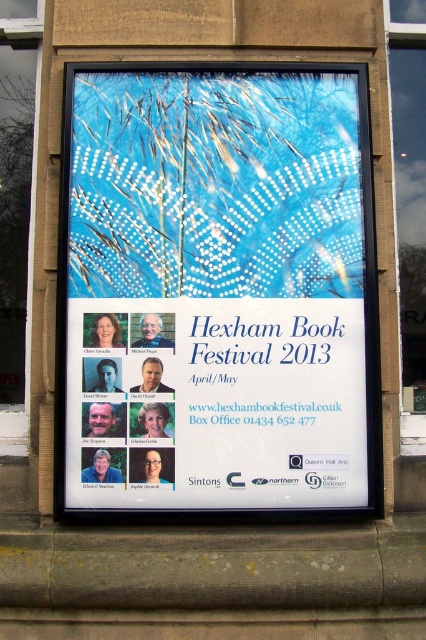
Question: Does blue paper poster at center appear on the left side of white paper poster at center?

Choices:
 (A) yes
 (B) no

Answer: (B)

Question: Which object is positioned closest to the transparent glass window at left?

Choices:
 (A) white paper poster at center
 (B) blue paper poster at center

Answer: (B)

Question: Does white paper poster at center lie behind transparent glass window at left?

Choices:
 (A) yes
 (B) no

Answer: (B)

Question: Which point appears closest to the camera in this image?

Choices:
 (A) (74, 349)
 (B) (17, 381)
 (C) (210, 508)
 (D) (419, 358)

Answer: (C)

Question: Is blue paper poster at center to the left of transparent glass window at center from the viewer's perspective?

Choices:
 (A) no
 (B) yes

Answer: (B)

Question: Based on their relative distances, which object is farther from the transparent glass window at center?

Choices:
 (A) transparent glass window at left
 (B) blue paper poster at center

Answer: (A)